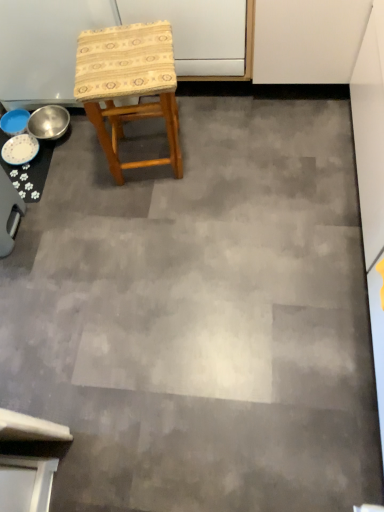
Question: Is woven fabric stool at center bigger or smaller than metallic silver bowl at left?

Choices:
 (A) big
 (B) small

Answer: (A)

Question: From a real-world perspective, is woven fabric stool at center physically located above or below metallic silver bowl at left?

Choices:
 (A) above
 (B) below

Answer: (A)

Question: Estimate the real-world distances between objects in this image. Which object is farther from the blue glossy bowls at left?

Choices:
 (A) woven fabric stool at center
 (B) white glossy plate at lower left
 (C) metallic silver bowl at left

Answer: (A)

Question: Considering the real-world distances, which object is farthest from the white glossy plate at lower left?

Choices:
 (A) metallic silver bowl at left
 (B) woven fabric stool at center
 (C) blue glossy bowls at left

Answer: (B)